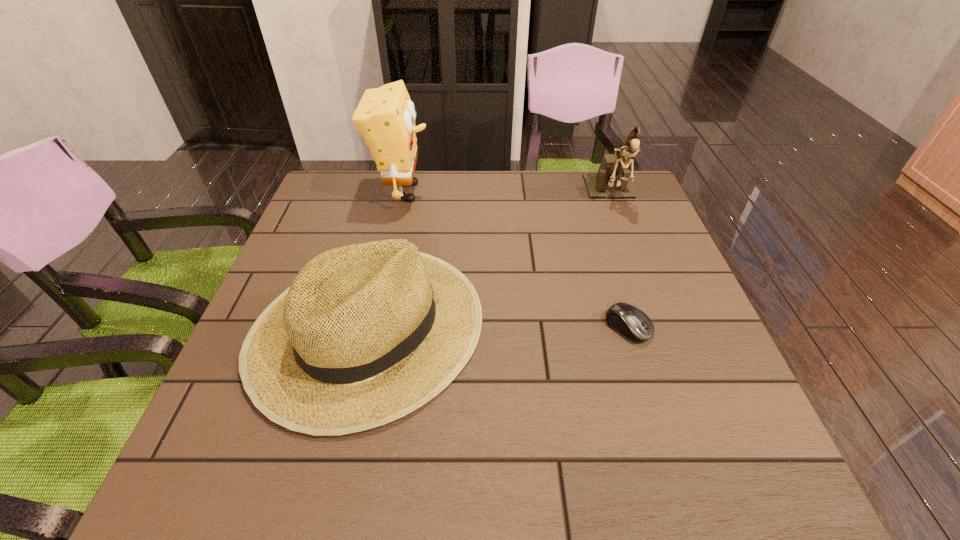
Image resolution: width=960 pixels, height=540 pixels. I want to click on vacant space that is in between the sponge and the shortest object, so click(x=516, y=259).

You are a GUI agent. You are given a task and a screenshot of the screen. Output one action in this format:
    pyautogui.click(x=<x>, y=<y>)
    Task: Click on the free area in between the sponge and the mouse
    The image size is (960, 540).
    Given the screenshot: What is the action you would take?
    pyautogui.click(x=516, y=259)

Where is `object that stands as the second closest to the sponge`? This screenshot has height=540, width=960. object that stands as the second closest to the sponge is located at coordinates (612, 180).

Identify the location of the second closest object to the sponge. (612, 180).

Identify the location of vacant region that satisfies the following two spatial constraints: 1. on the face of the sponge; 2. on the left side of the shortest object. The height and width of the screenshot is (540, 960). (373, 327).